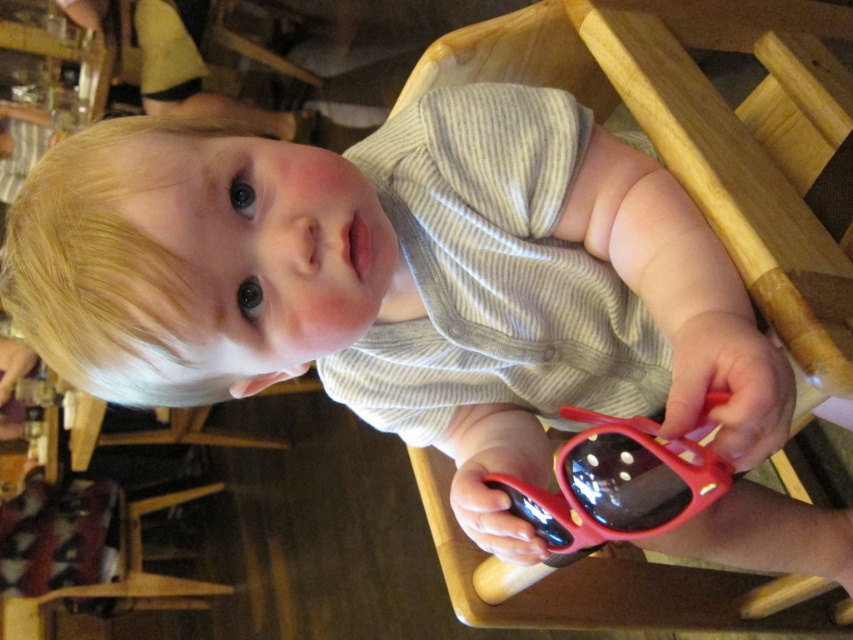
Question: Is wooden chair at center wider than red rubber sunglasses at center?

Choices:
 (A) no
 (B) yes

Answer: (B)

Question: Which point is farther to the camera?

Choices:
 (A) (746, 227)
 (B) (625, 445)

Answer: (A)

Question: Which object is closer to the camera taking this photo?

Choices:
 (A) red rubber sunglasses at center
 (B) wooden chair at center

Answer: (A)

Question: Can you confirm if wooden chair at center is bigger than red rubber sunglasses at center?

Choices:
 (A) yes
 (B) no

Answer: (A)

Question: Is wooden chair at center to the right of red rubber sunglasses at center from the viewer's perspective?

Choices:
 (A) no
 (B) yes

Answer: (B)